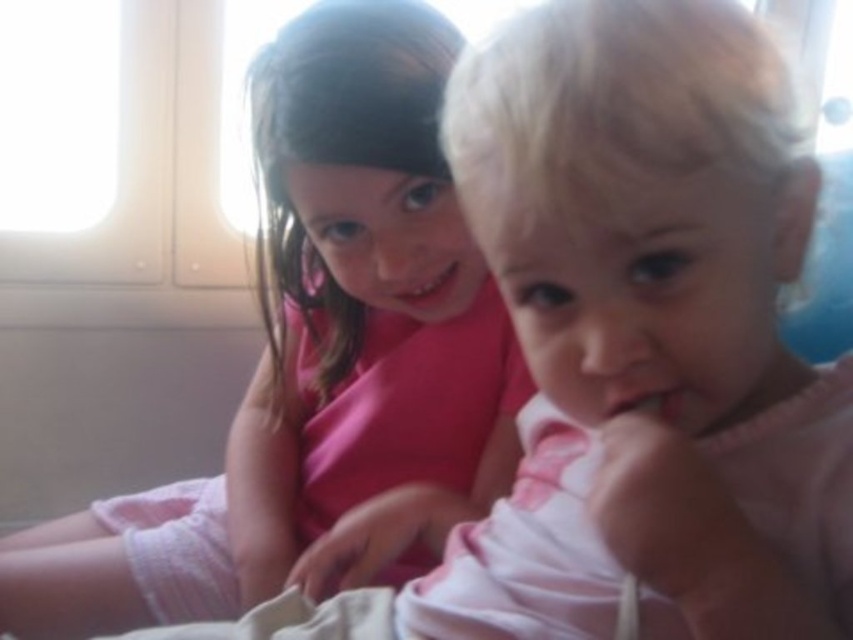
Who is positioned more to the left, matte pink mouth at center or pink matte mouth at center?

matte pink mouth at center is more to the left.

Is matte pink mouth at center to the right of pink matte mouth at center from the viewer's perspective?

In fact, matte pink mouth at center is to the left of pink matte mouth at center.

This screenshot has height=640, width=853. What are the coordinates of `matte pink mouth at center` in the screenshot? It's located at (432, 289).

Where is `matte pink mouth at center`? matte pink mouth at center is located at coordinates (432, 289).

Can you confirm if pink matte shirt at upper left is shorter than matte pink mouth at center?

No.

Does pink matte shirt at upper left have a smaller size compared to matte pink mouth at center?

No, pink matte shirt at upper left is not smaller than matte pink mouth at center.

Is point (267, 461) positioned in front of point (422, 260)?

No, (267, 461) is further to viewer.

Locate an element on the screen. This screenshot has width=853, height=640. pink matte shirt at upper left is located at coordinates (316, 358).

Is pink matte shirt at upper left closer to the viewer compared to pink matte mouth at center?

No, it is behind pink matte mouth at center.

Who is lower down, pink matte shirt at upper left or pink matte mouth at center?

pink matte shirt at upper left

Where is `pink matte shirt at upper left`? Image resolution: width=853 pixels, height=640 pixels. pink matte shirt at upper left is located at coordinates (316, 358).